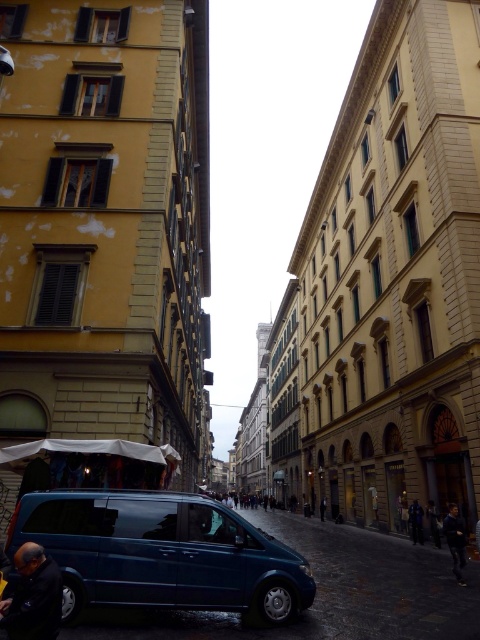
You are a pedestrian standing on the street and see the shiny blue van at center and the dark blue fabric jacket at lower left. Which object is bigger in size?

The shiny blue van at center is larger in size compared to the dark blue fabric jacket at lower left.

You are a tourist standing on the street in the European city scene. You see two points marked on the image. The first point is at coordinate (x=179, y=518) and the second is at (x=56, y=637). Which point is closer to you?

Point (x=179, y=518) is closer to you because it is further to the viewer than point (x=56, y=637).